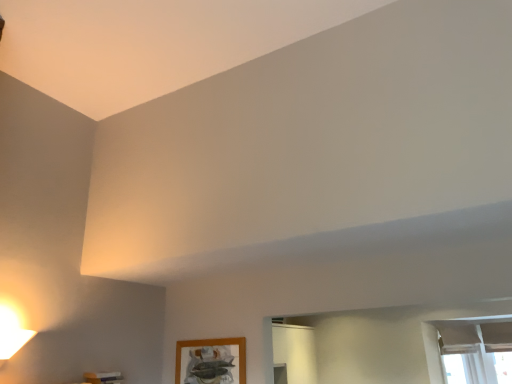
Question: Does matte white remote at lower left come behind white sheer curtain at lower right?

Choices:
 (A) no
 (B) yes

Answer: (A)

Question: From a real-world perspective, is matte white remote at lower left on top of white sheer curtain at lower right?

Choices:
 (A) no
 (B) yes

Answer: (A)

Question: From the image's perspective, does matte white remote at lower left appear lower than white sheer curtain at lower right?

Choices:
 (A) no
 (B) yes

Answer: (A)

Question: Is matte white remote at lower left not within white sheer curtain at lower right?

Choices:
 (A) no
 (B) yes

Answer: (B)

Question: Does matte white remote at lower left contain white sheer curtain at lower right?

Choices:
 (A) no
 (B) yes

Answer: (A)

Question: In the image, is white sheer curtain at lower right positioned in front of or behind matte white remote at lower left?

Choices:
 (A) front
 (B) behind

Answer: (B)

Question: Is point (481, 337) closer or farther from the camera than point (109, 382)?

Choices:
 (A) farther
 (B) closer

Answer: (A)

Question: Is white sheer curtain at lower right bigger or smaller than matte white remote at lower left?

Choices:
 (A) small
 (B) big

Answer: (B)

Question: In terms of height, does white sheer curtain at lower right look taller or shorter compared to matte white remote at lower left?

Choices:
 (A) short
 (B) tall

Answer: (B)

Question: In the image, is matte white remote at lower left positioned in front of or behind white sheer curtain at lower right?

Choices:
 (A) behind
 (B) front

Answer: (B)

Question: From a real-world perspective, is matte white remote at lower left above or below white sheer curtain at lower right?

Choices:
 (A) above
 (B) below

Answer: (B)

Question: Is point (119, 382) closer or farther from the camera than point (444, 324)?

Choices:
 (A) farther
 (B) closer

Answer: (B)

Question: Visually, is matte white remote at lower left positioned to the left or to the right of white sheer curtain at lower right?

Choices:
 (A) right
 (B) left

Answer: (B)

Question: Is wooden picture frame at lower center taller or shorter than white sheer curtain at lower right?

Choices:
 (A) tall
 (B) short

Answer: (B)

Question: Visually, is wooden picture frame at lower center positioned to the left or to the right of white sheer curtain at lower right?

Choices:
 (A) right
 (B) left

Answer: (B)